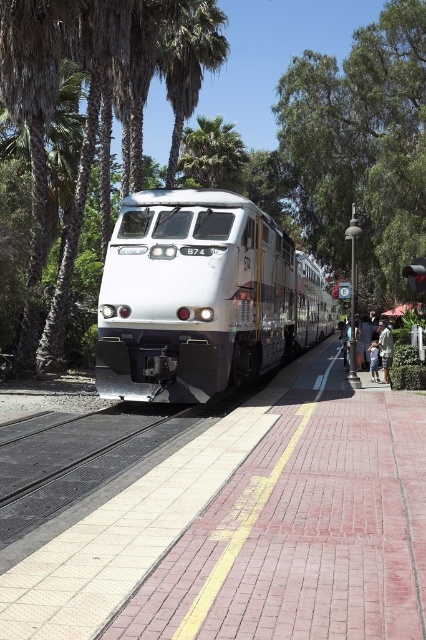
You are a maintenance worker standing at the platform edge near the light brown textured shirt at right. You need to reach the green leafy tree at upper center to trim its branches. Considering the safety regulations require a minimum distance of 10 meters between workers and the train tracks for safety, can you safely perform the trimming from your current position?

The distance between the green leafy tree at upper center and the light brown textured shirt at right is 10.20 meters. Since the safety regulation requires a minimum of 10 meters, this distance meets the requirement. Therefore, you can safely trim the branches from your current position near the light brown textured shirt at right.

You are a traveler who just arrived at the train station and see the green leafy tree at upper center and the light brown leather jacket at lower right. Which object is bigger in size?

The green leafy tree at upper center is larger in size compared to the light brown leather jacket at lower right.

You are a passenger at the train station and notice two items left on the platform. The items are the light brown leather jacket at lower right and the light brown textured shirt at right. Which item is positioned closer to the yellow tactile paving strip along the platform edge?

The light brown leather jacket at lower right is positioned closer to the yellow tactile paving strip along the platform edge because it is to the left of the light brown textured shirt at right, and the yellow strip is at the edge of the platform.